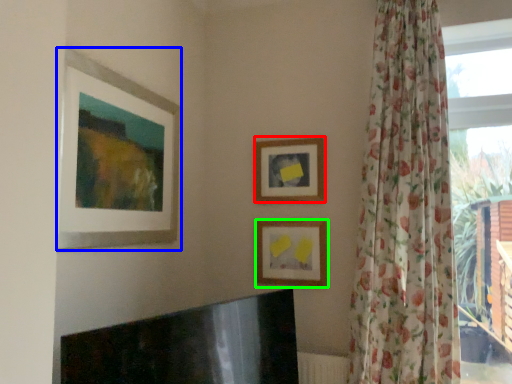
Question: Based on their relative distances, which object is nearer to picture frame (highlighted by a red box)? Choose from picture frame (highlighted by a blue box) and picture frame (highlighted by a green box).

Choices:
 (A) picture frame
 (B) picture frame

Answer: (B)